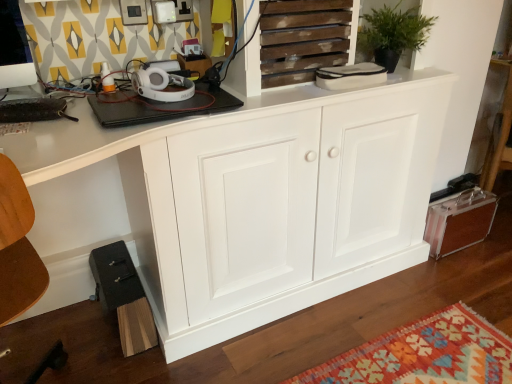
Question: Does wooden slats at upper center touch green matte plant at upper center?

Choices:
 (A) yes
 (B) no

Answer: (B)

Question: Is wooden slats at upper center closer to camera compared to green matte plant at upper center?

Choices:
 (A) no
 (B) yes

Answer: (B)

Question: From the image's perspective, is wooden slats at upper center located above green matte plant at upper center?

Choices:
 (A) yes
 (B) no

Answer: (B)

Question: Does wooden slats at upper center have a larger size compared to green matte plant at upper center?

Choices:
 (A) no
 (B) yes

Answer: (A)

Question: Can you confirm if wooden slats at upper center is smaller than green matte plant at upper center?

Choices:
 (A) yes
 (B) no

Answer: (A)

Question: From the image's perspective, is metallic brown suitcase at lower right, which appears as the first cabinetry when viewed from the right, located above or below wooden slats at upper center?

Choices:
 (A) above
 (B) below

Answer: (B)

Question: Is metallic brown suitcase at lower right, which appears as the first cabinetry when viewed from the right, situated inside wooden slats at upper center or outside?

Choices:
 (A) inside
 (B) outside

Answer: (B)

Question: Is point (445, 241) positioned closer to the camera than point (283, 54)?

Choices:
 (A) farther
 (B) closer

Answer: (A)

Question: From their relative heights in the image, would you say metallic brown suitcase at lower right, which is counted as the 2th cabinetry, starting from the left, is taller or shorter than wooden slats at upper center?

Choices:
 (A) short
 (B) tall

Answer: (B)

Question: Considering the positions of point (293, 79) and point (480, 196), is point (293, 79) closer or farther from the camera than point (480, 196)?

Choices:
 (A) closer
 (B) farther

Answer: (A)

Question: From the image's perspective, relative to metallic brown suitcase at lower right, which appears as the first cabinetry when viewed from the right, is wooden slats at upper center above or below?

Choices:
 (A) above
 (B) below

Answer: (A)

Question: Considering the positions of wooden slats at upper center and metallic brown suitcase at lower right, which is counted as the 2th cabinetry, starting from the left, in the image, is wooden slats at upper center taller or shorter than metallic brown suitcase at lower right, which is counted as the 2th cabinetry, starting from the left,?

Choices:
 (A) short
 (B) tall

Answer: (A)

Question: Choose the correct answer: Is wooden slats at upper center inside metallic brown suitcase at lower right, which appears as the first cabinetry when viewed from the right, or outside it?

Choices:
 (A) inside
 (B) outside

Answer: (B)

Question: Looking at their shapes, would you say green matte plant at upper center is wider or thinner than wooden slats at upper center?

Choices:
 (A) thin
 (B) wide

Answer: (B)

Question: Is green matte plant at upper center inside the boundaries of wooden slats at upper center, or outside?

Choices:
 (A) inside
 (B) outside

Answer: (B)